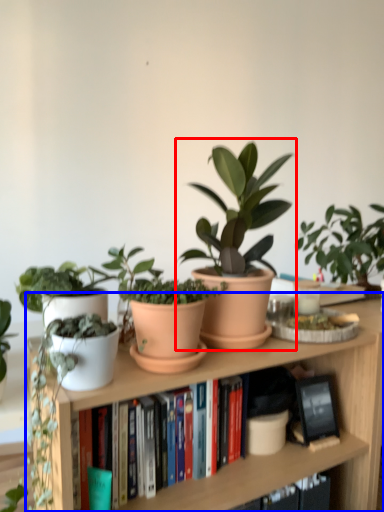
Question: Which of the following is the closest to the observer, houseplant (highlighted by a red box) or bookcase (highlighted by a blue box)?

Choices:
 (A) houseplant
 (B) bookcase

Answer: (B)